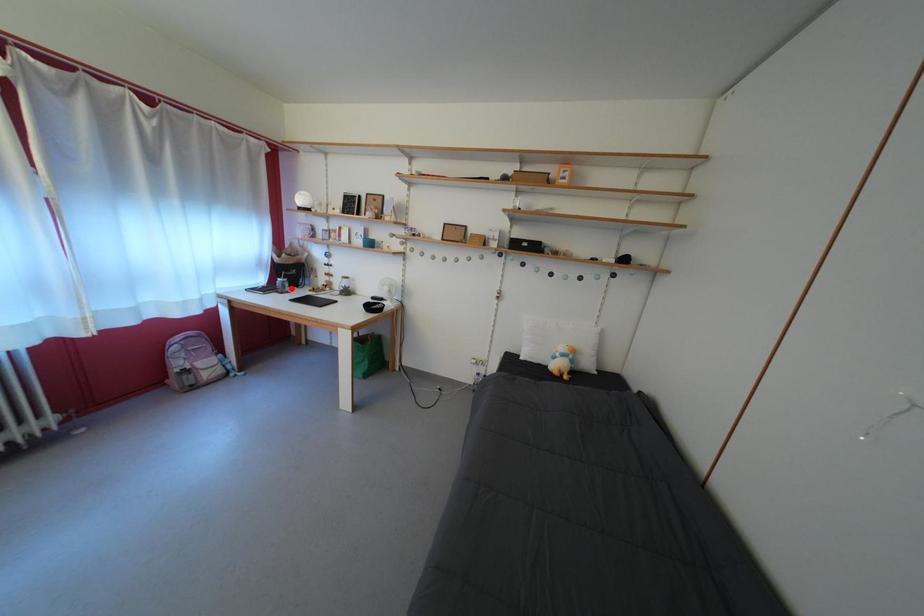
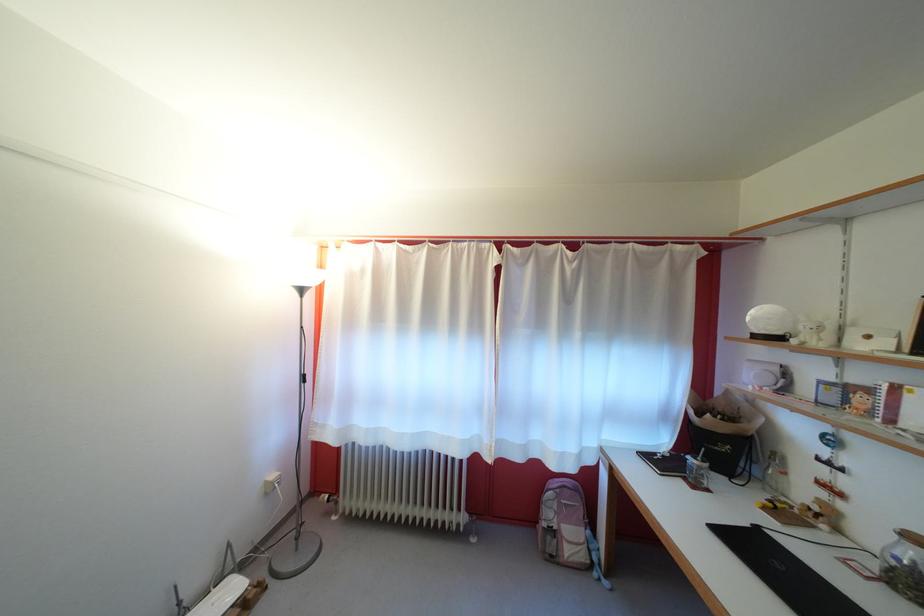
Question: I am providing you with two images of the same scene from different viewpoints. A red point is shown in image1. For the corresponding object point in image2, is it positioned nearer or farther from the camera?

Choices:
 (A) Nearer
 (B) Farther

Answer: (B)